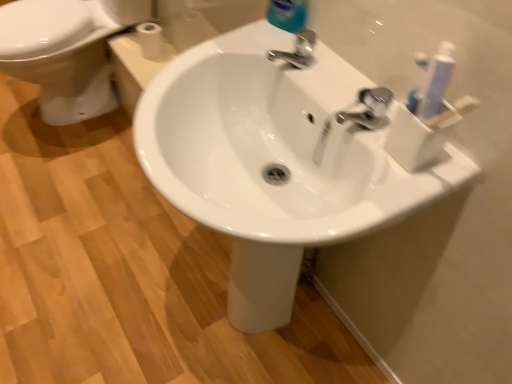
Identify the location of vacant region to the left of silver metallic faucet at upper center, the 2th tap in the right-to-left sequence. (232, 48).